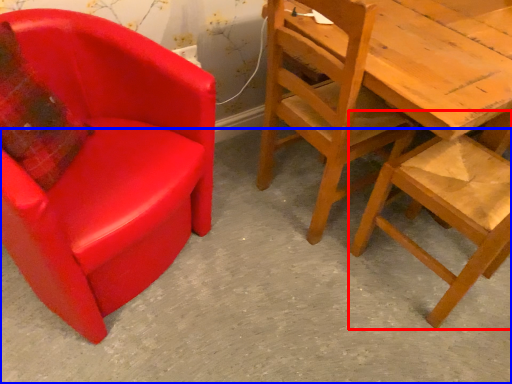
Question: Which point is closer to the camera, chair (highlighted by a red box) or concrete (highlighted by a blue box)?

Choices:
 (A) chair
 (B) concrete

Answer: (B)